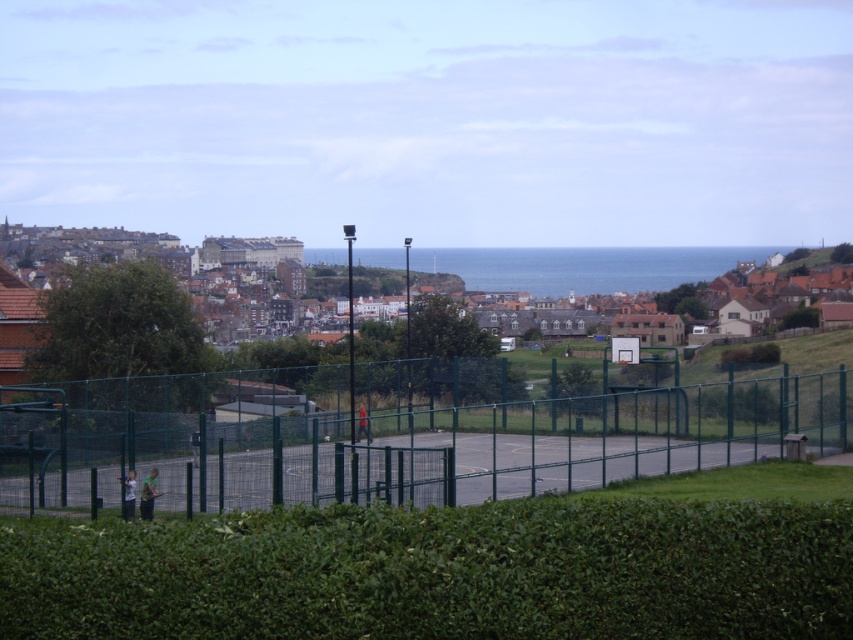
Question: Can you confirm if green leafy hedge at center is positioned above light blue fabric shirt at lower left?

Choices:
 (A) yes
 (B) no

Answer: (A)

Question: Can you confirm if green metal fence at center is bigger than light blue fabric shirt at lower left?

Choices:
 (A) yes
 (B) no

Answer: (A)

Question: Which of the following is the closest to the observer?

Choices:
 (A) (763, 349)
 (B) (679, 508)
 (C) (146, 502)

Answer: (B)

Question: Which point is closer to the camera?

Choices:
 (A) (154, 488)
 (B) (520, 435)
 (C) (125, 506)
 (D) (746, 368)

Answer: (C)

Question: Which object appears farthest from the camera in this image?

Choices:
 (A) orange fabric person at center
 (B) light blue fabric shirt at lower left
 (C) green leafy hedge at center
 (D) green leafy hedge at lower center

Answer: (C)

Question: From the image, what is the correct spatial relationship of green leafy hedge at lower center in relation to orange fabric person at center?

Choices:
 (A) right
 (B) left

Answer: (A)